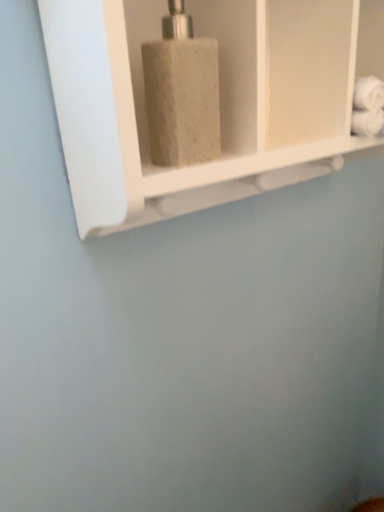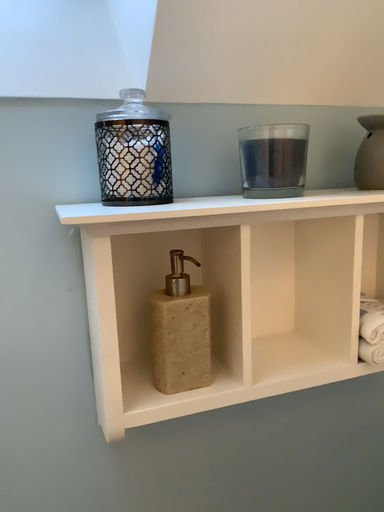
Question: Which way did the camera rotate in the video?

Choices:
 (A) rotated upward
 (B) rotated downward

Answer: (A)